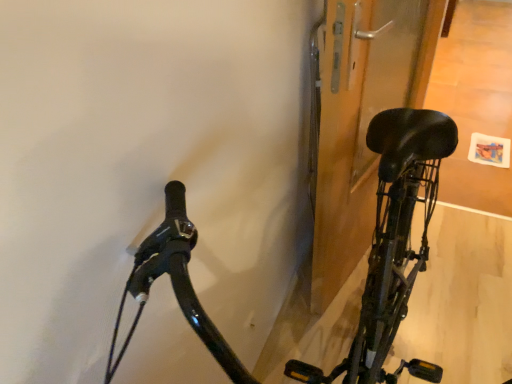
What do you see at coordinates (393, 241) in the screenshot? This screenshot has width=512, height=384. I see `black matte bicycle at center` at bounding box center [393, 241].

Identify the location of black matte bicycle at center. (393, 241).

What is the approximate height of black matte bicycle at center?

1.17 meters.

Locate an element on the screen. The height and width of the screenshot is (384, 512). black matte bicycle at center is located at coordinates (393, 241).